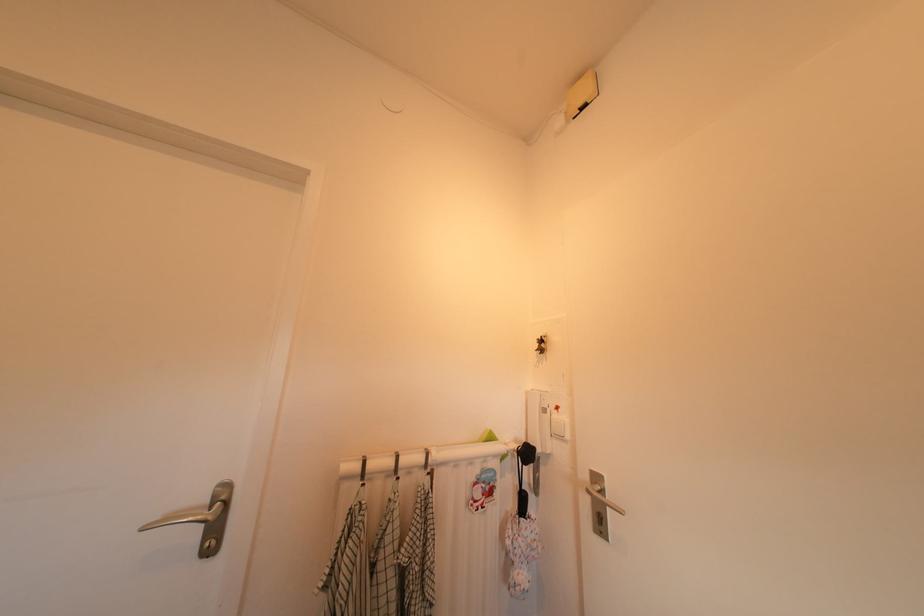
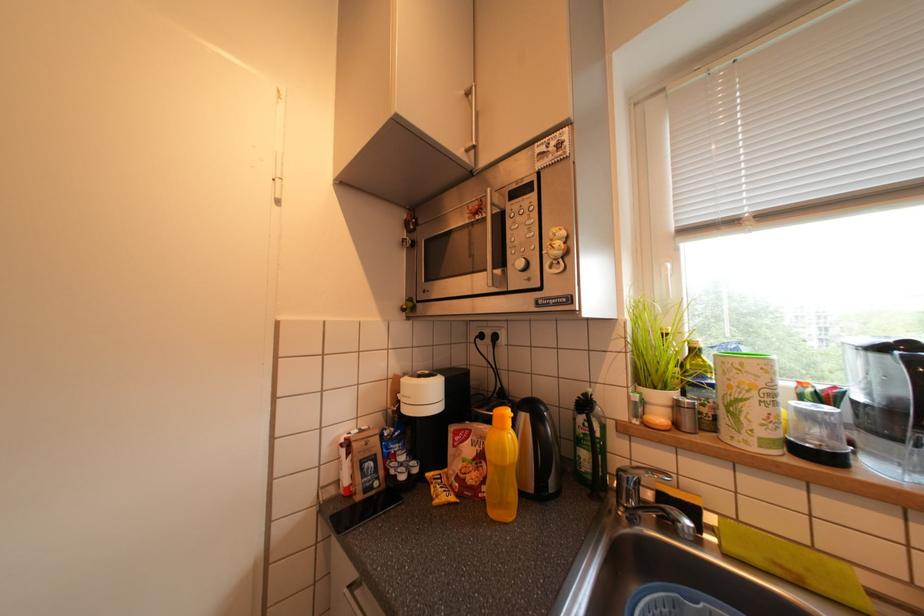
Question: How did the camera likely rotate?

Choices:
 (A) Left
 (B) Right
 (C) Up
 (D) Down

Answer: (B)